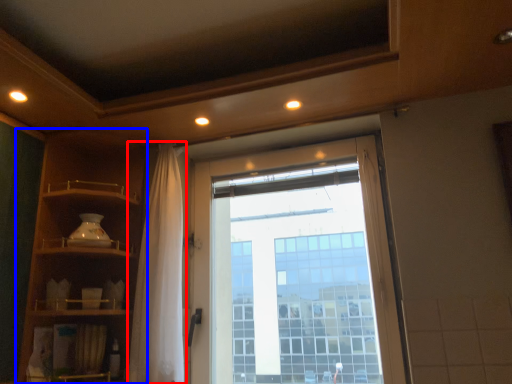
Question: Which object is closer to the camera taking this photo, shower curtain (highlighted by a red box) or shelf (highlighted by a blue box)?

Choices:
 (A) shower curtain
 (B) shelf

Answer: (B)